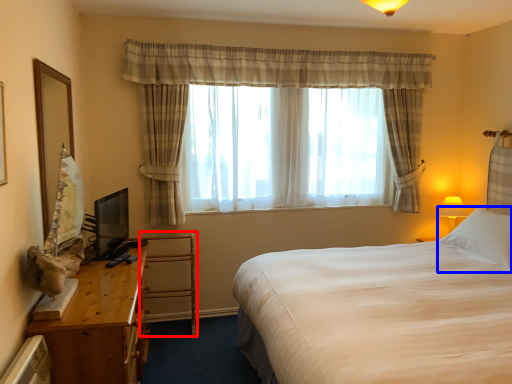
Question: Which object appears closest to the camera in this image, armchair (highlighted by a red box) or pillow (highlighted by a blue box)?

Choices:
 (A) armchair
 (B) pillow

Answer: (B)